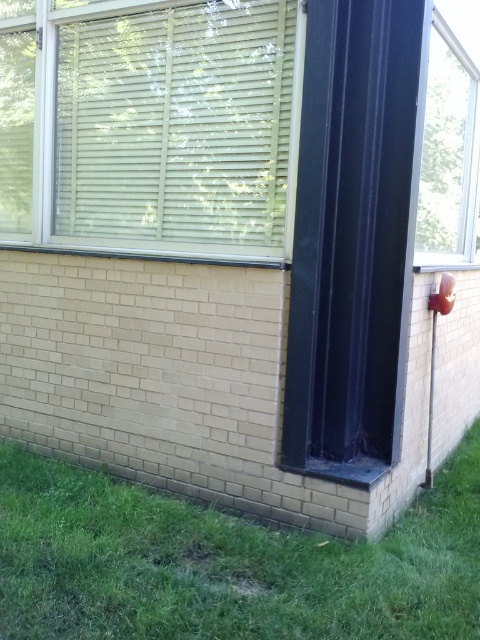
Question: Estimate the real-world distances between objects in this image. Which object is farther from the green grass at lower left?

Choices:
 (A) clear glass window at upper right
 (B) white plastic blinds at upper left

Answer: (A)

Question: Does green grass at lower left have a larger size compared to white plastic blinds at upper left?

Choices:
 (A) no
 (B) yes

Answer: (A)

Question: Can you confirm if green grass at lower left is wider than white plastic blinds at upper left?

Choices:
 (A) no
 (B) yes

Answer: (B)

Question: Which point appears farthest from the camera in this image?

Choices:
 (A) (95, 198)
 (B) (472, 97)

Answer: (B)

Question: Does green grass at lower left have a larger size compared to white plastic blinds at upper left?

Choices:
 (A) no
 (B) yes

Answer: (A)

Question: Which point appears closest to the camera in this image?

Choices:
 (A) (458, 68)
 (B) (26, 531)

Answer: (B)